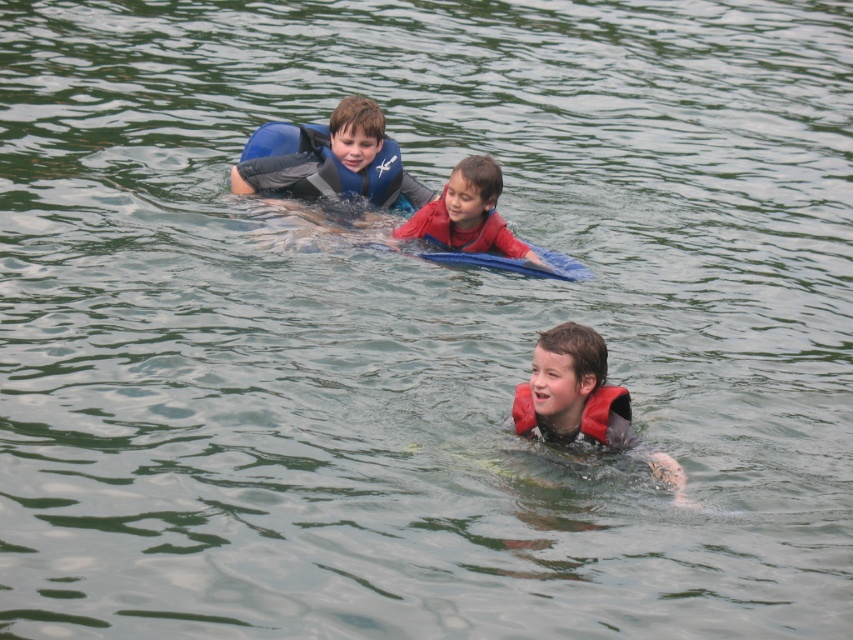
Question: Is orange matte life jacket at center above red matte life jacket at center?

Choices:
 (A) no
 (B) yes

Answer: (A)

Question: Which point appears closest to the camera in this image?

Choices:
 (A) (389, 163)
 (B) (585, 346)
 (C) (489, 212)
 (D) (599, 400)

Answer: (B)

Question: Which of the following is the closest to the observer?

Choices:
 (A) orange matte life jacket at center
 (B) red matte life jacket at center

Answer: (A)

Question: Is red life vest at center thinner than orange matte life jacket at center?

Choices:
 (A) yes
 (B) no

Answer: (B)

Question: Which object appears closest to the camera in this image?

Choices:
 (A) blue matte life jacket at upper center
 (B) red matte life vest at center

Answer: (B)

Question: Where is red matte life vest at center located in relation to orange matte life jacket at center in the image?

Choices:
 (A) right
 (B) left

Answer: (B)